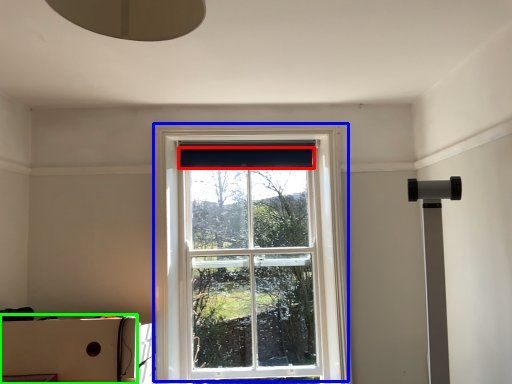
Question: Estimate the real-world distances between objects in this image. Which object is farther from curtain (highlighted by a red box), window (highlighted by a blue box) or cardboard box (highlighted by a green box)?

Choices:
 (A) window
 (B) cardboard box

Answer: (B)